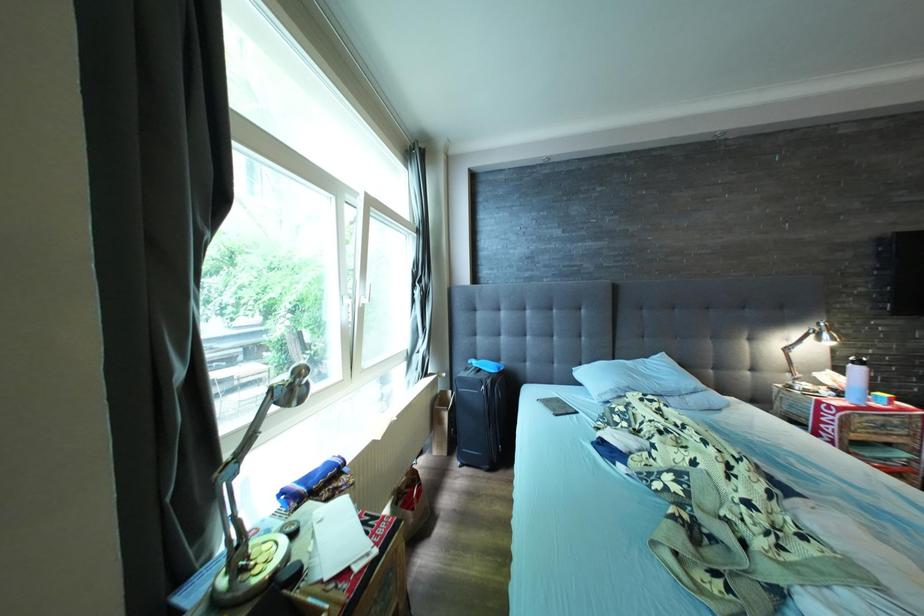
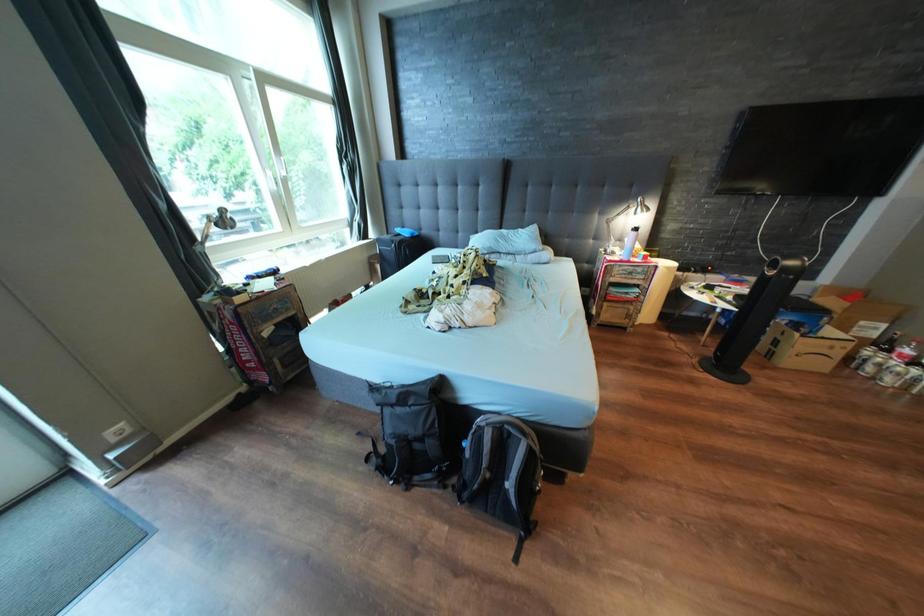
What movement of the cameraman would produce the second image?

The cameraman walked toward right, backward.